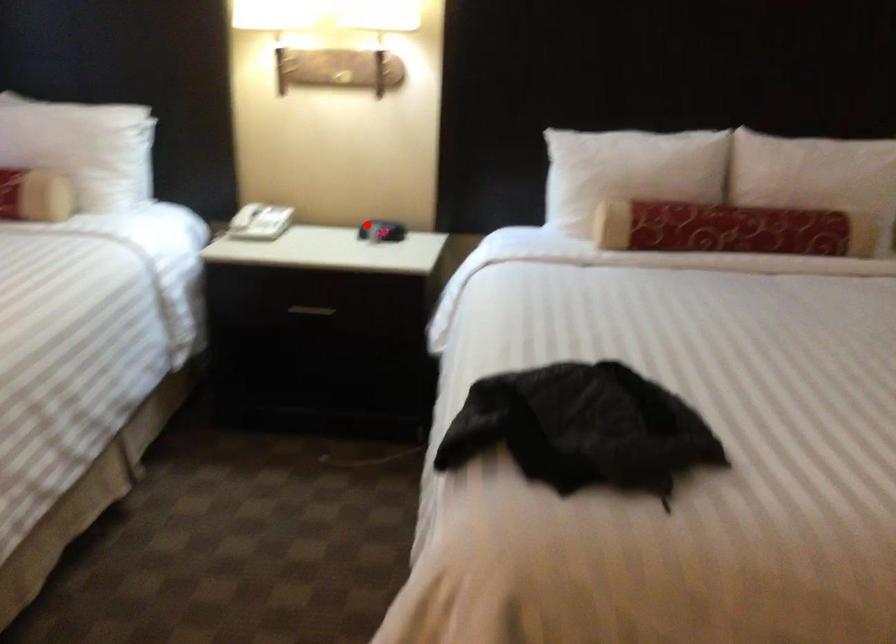
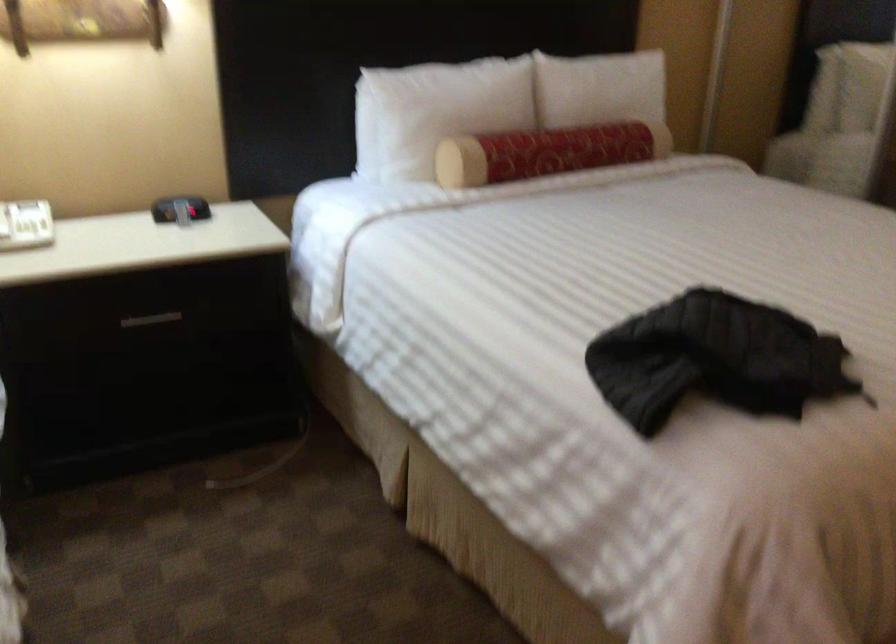
Where in the second image is the point corresponding to the highlighted location from the first image?

(179, 209)